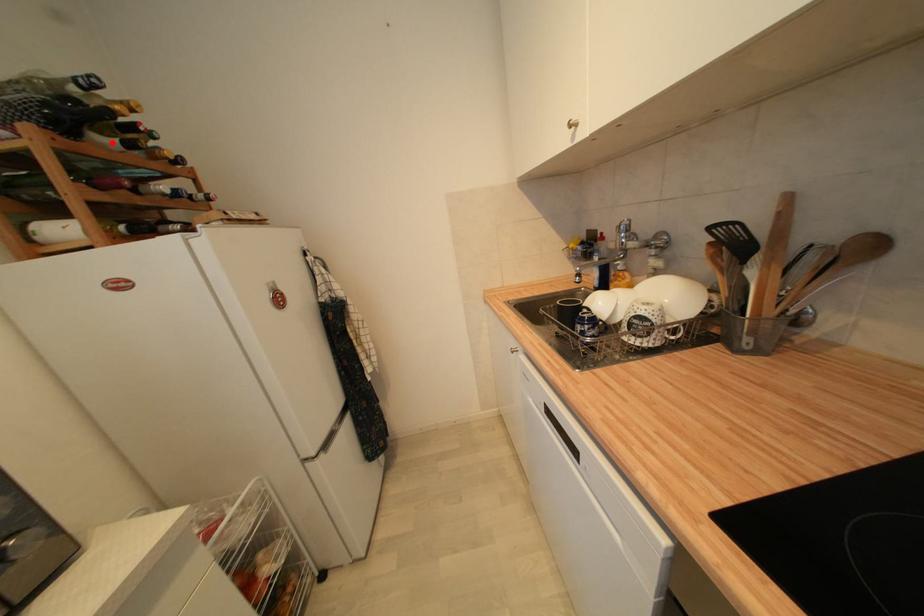
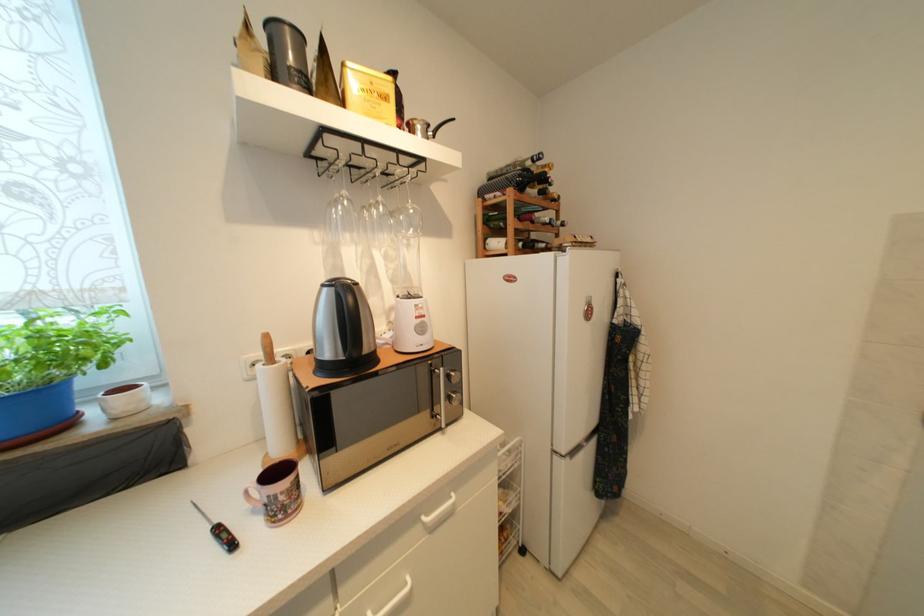
In the second image, find the point that corresponds to the highlighted location in the first image.

(538, 193)